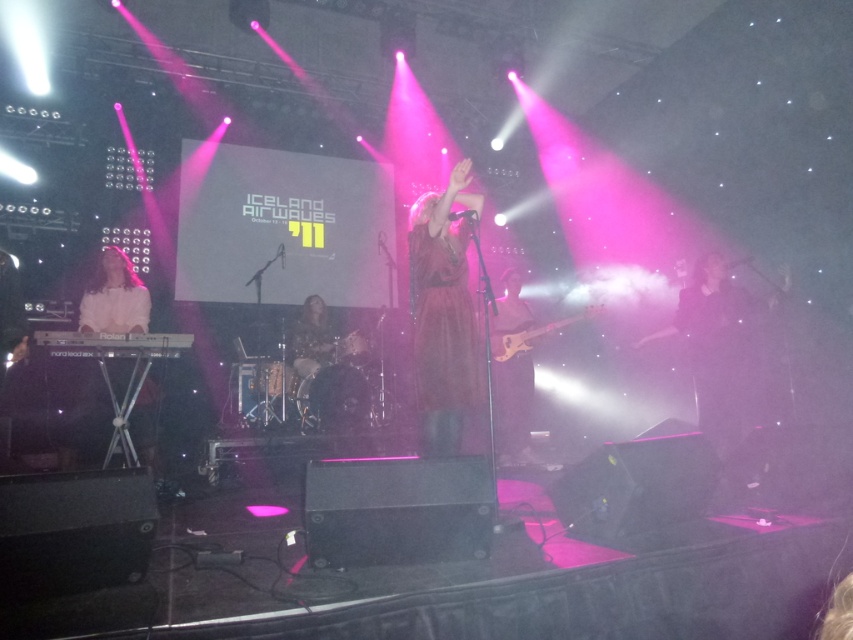
Question: Estimate the real-world distances between objects in this image. Which object is farther from the wooden electric guitar at center?

Choices:
 (A) black fabric at center
 (B) floral-patterned dress at center

Answer: (B)

Question: Does matte brown guitar at center have a smaller size compared to floral-patterned dress at center?

Choices:
 (A) no
 (B) yes

Answer: (A)

Question: Which point is farther to the camera?

Choices:
 (A) click(x=749, y=321)
 (B) click(x=517, y=368)
 (C) click(x=555, y=326)
 (D) click(x=302, y=339)

Answer: (D)

Question: Is black fabric at center to the right of matte brown guitar at center from the viewer's perspective?

Choices:
 (A) yes
 (B) no

Answer: (A)

Question: In this image, where is matte brown guitar at center located relative to wooden electric guitar at center?

Choices:
 (A) above
 (B) below

Answer: (B)

Question: Which object appears closest to the camera in this image?

Choices:
 (A) matte brown guitar at center
 (B) wooden electric guitar at center
 (C) black fabric at center
 (D) floral-patterned dress at center

Answer: (C)